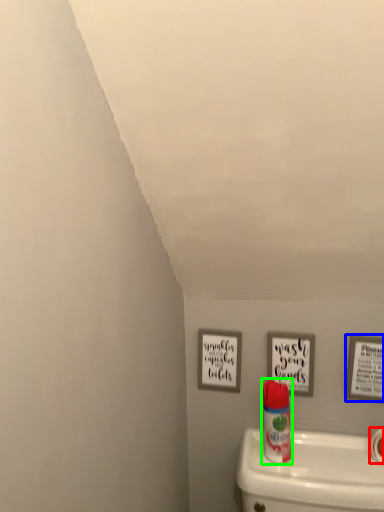
Question: Estimate the real-world distances between objects in this image. Which object is closer to toilet paper (highlighted by a red box), picture frame (highlighted by a blue box) or cleaning product (highlighted by a green box)?

Choices:
 (A) picture frame
 (B) cleaning product

Answer: (A)